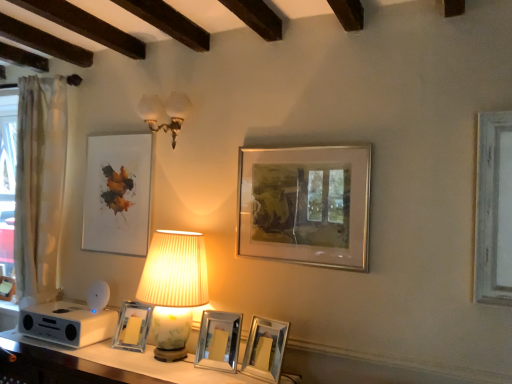
Question: Is matte white picture frame at upper left, which is counted as the fifth picture frame, starting from the right, not near clear glass photo frame at center, the second picture frame from the left?

Choices:
 (A) no
 (B) yes

Answer: (A)

Question: Can you confirm if matte white picture frame at upper left, which is counted as the first picture frame, starting from the left, is wider than clear glass photo frame at center, the second picture frame from the left?

Choices:
 (A) yes
 (B) no

Answer: (B)

Question: Does matte white picture frame at upper left, which is counted as the first picture frame, starting from the left, appear on the right side of clear glass photo frame at center, the second picture frame from the left?

Choices:
 (A) yes
 (B) no

Answer: (B)

Question: Does matte white picture frame at upper left, which is counted as the first picture frame, starting from the left, have a greater height compared to clear glass photo frame at center, the second picture frame from the left?

Choices:
 (A) yes
 (B) no

Answer: (A)

Question: Considering the relative positions of matte white picture frame at upper left, which is counted as the first picture frame, starting from the left, and clear glass photo frame at center, the second picture frame from the left, in the image provided, is matte white picture frame at upper left, which is counted as the first picture frame, starting from the left, to the left of clear glass photo frame at center, the second picture frame from the left, from the viewer's perspective?

Choices:
 (A) no
 (B) yes

Answer: (B)

Question: From a real-world perspective, is clear glass photo frame at center, the second picture frame from the left, above or below silver/metallic picture frame at center-right, which appears as the fifth picture frame when viewed from the left?

Choices:
 (A) below
 (B) above

Answer: (A)

Question: In terms of width, does clear glass photo frame at center, positioned as the 4th picture frame in right-to-left order, look wider or thinner when compared to silver/metallic picture frame at center-right, the 1th picture frame when ordered from right to left?

Choices:
 (A) wide
 (B) thin

Answer: (A)

Question: In the image, is clear glass photo frame at center, positioned as the 4th picture frame in right-to-left order, on the left side or the right side of silver/metallic picture frame at center-right, the 1th picture frame when ordered from right to left?

Choices:
 (A) left
 (B) right

Answer: (A)

Question: Considering the positions of point (128, 316) and point (292, 155), is point (128, 316) closer or farther from the camera than point (292, 155)?

Choices:
 (A) closer
 (B) farther

Answer: (B)

Question: Is white glossy table at lower center inside or outside of silver/metallic picture frame at center-right, the 1th picture frame when ordered from right to left?

Choices:
 (A) outside
 (B) inside

Answer: (A)

Question: In the image, is white glossy table at lower center positioned in front of or behind silver/metallic picture frame at center-right, the 1th picture frame when ordered from right to left?

Choices:
 (A) front
 (B) behind

Answer: (A)

Question: Looking at their shapes, would you say white glossy table at lower center is wider or thinner than silver/metallic picture frame at center-right, the 1th picture frame when ordered from right to left?

Choices:
 (A) wide
 (B) thin

Answer: (A)

Question: Would you say white glossy table at lower center is to the left or to the right of silver/metallic picture frame at center-right, which appears as the fifth picture frame when viewed from the left, in the picture?

Choices:
 (A) left
 (B) right

Answer: (A)

Question: Is point (159, 125) positioned closer to the camera than point (346, 168)?

Choices:
 (A) farther
 (B) closer

Answer: (A)

Question: Is white glass sconce at upper center, positioned as the second lamp in bottom-to-top order, wider or thinner than silver/metallic picture frame at center-right, which appears as the fifth picture frame when viewed from the left?

Choices:
 (A) wide
 (B) thin

Answer: (A)